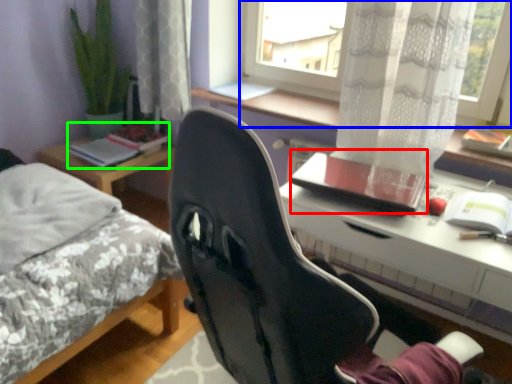
Question: Which is nearer to the notebook (highlighted by a red box)? window (highlighted by a blue box) or book (highlighted by a green box).

Choices:
 (A) window
 (B) book

Answer: (A)